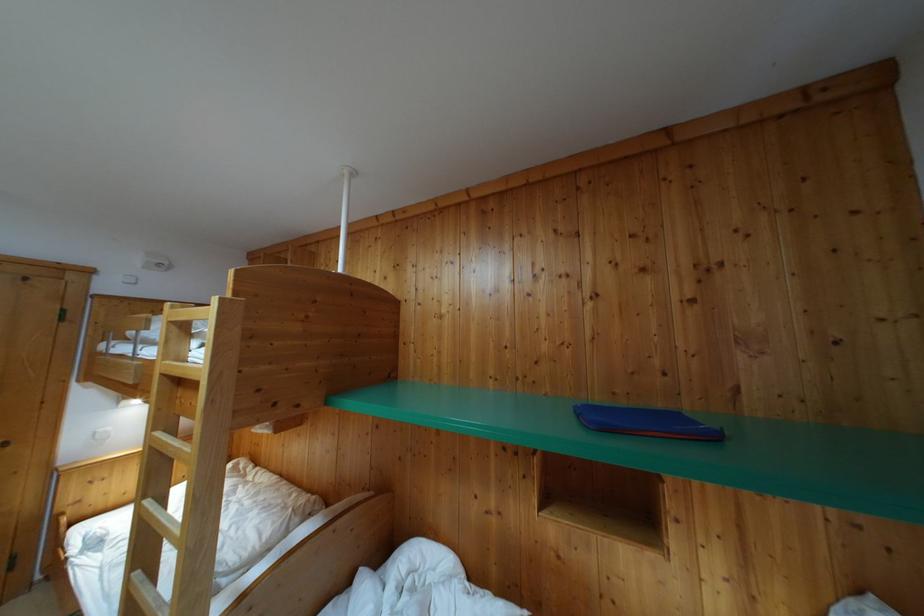
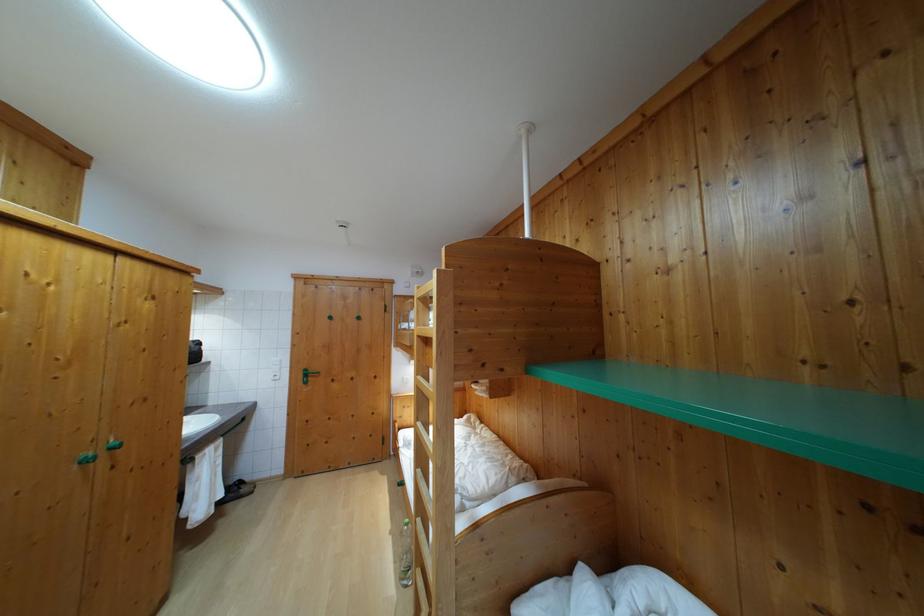
The point at (167,381) is marked in the first image. Where is the corresponding point in the second image?

(421, 342)